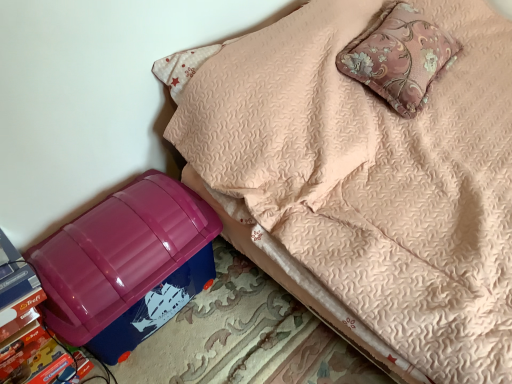
You are a GUI agent. You are given a task and a screenshot of the screen. Output one action in this format:
    pyautogui.click(x=<x>, y=<y>)
    Task: Click on the free space above glossy plastic storage box at lower left (from a real-world perspective)
    The height and width of the screenshot is (384, 512).
    Given the screenshot: What is the action you would take?
    pyautogui.click(x=91, y=236)